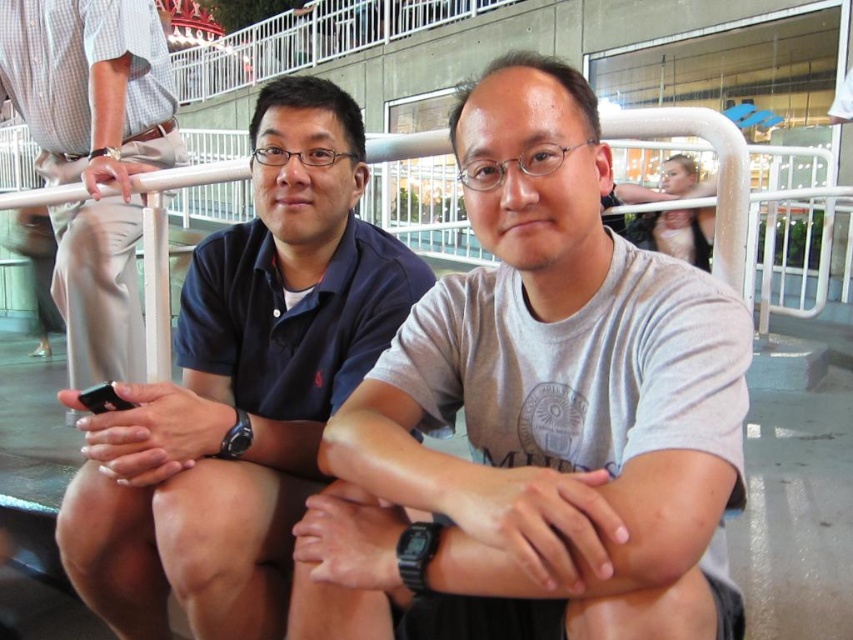
Question: Based on their relative distances, which object is nearer to the light brown fabric pants at left?

Choices:
 (A) dark blue shirt at left
 (B) white metal rail at upper center

Answer: (A)

Question: Which of the following is the closest to the observer?

Choices:
 (A) white metal rail at upper center
 (B) dark blue shirt at left
 (C) light brown fabric pants at left

Answer: (A)

Question: Observing the image, what is the correct spatial positioning of gray cotton t-shirt at center in reference to white metal rail at upper center?

Choices:
 (A) above
 (B) below

Answer: (B)

Question: Where is dark blue shirt at left located in relation to white metal rail at upper center in the image?

Choices:
 (A) right
 (B) left

Answer: (B)

Question: Which object is positioned farthest from the dark blue shirt at left?

Choices:
 (A) white metal rail at upper center
 (B) gray cotton t-shirt at center

Answer: (A)

Question: Is light brown fabric pants at left positioned behind white metal rail at upper center?

Choices:
 (A) no
 (B) yes

Answer: (B)